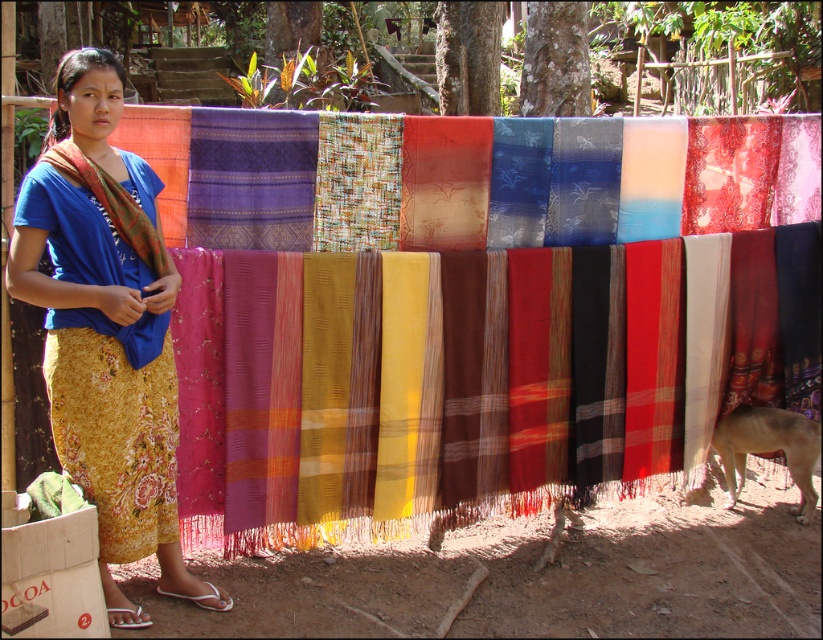
You are a delivery person who needs to place a package between the matte woven cloth at center and the brown fur dog at lower right. Can you fit the package in the space between them if the package is 30 inches long?

The matte woven cloth at center and brown fur dog at lower right are 32.64 inches apart. Since the package is 30 inches long, it can fit in the space between them as there is enough room.

You are standing in the rural area shown in the image. You see a point at coordinates (105,326). What object is located at that point?

The point at coordinates (105,326) marks the location of the matte blue shirt at center.

You are a customer at a fabric market and want to buy a piece of clothing that is larger than the other. Which one should you choose between the matte blue shirt at center and the matte orange shawl at left?

The matte blue shirt at center is bigger than the matte orange shawl at left, so you should choose the matte blue shirt at center.